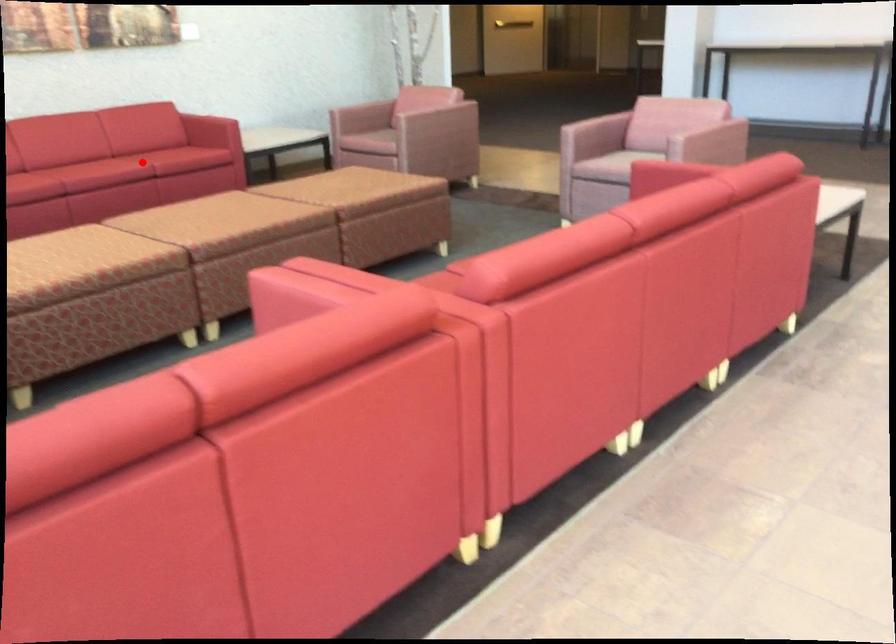
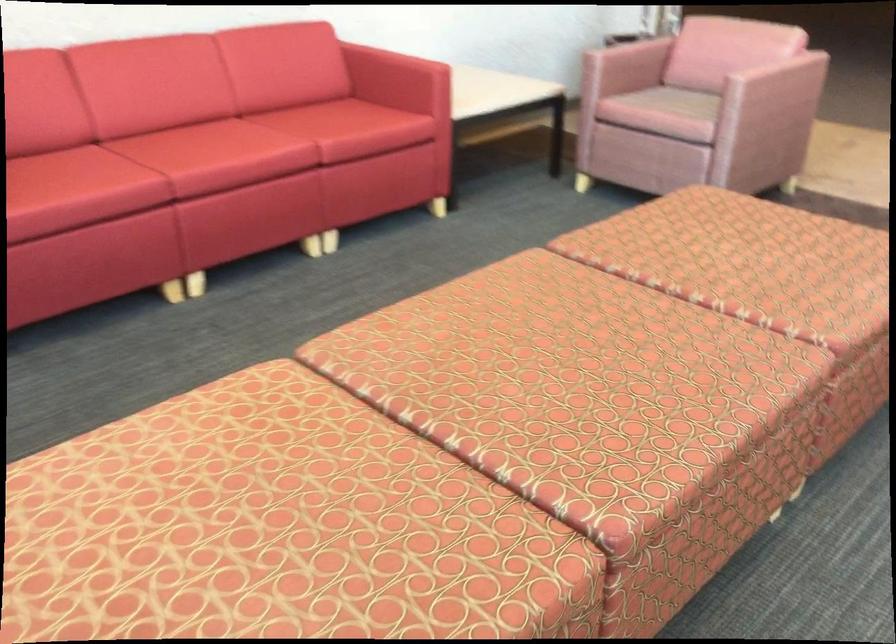
Locate, in the second image, the point that corresponds to the highlighted location in the first image.

(309, 156)